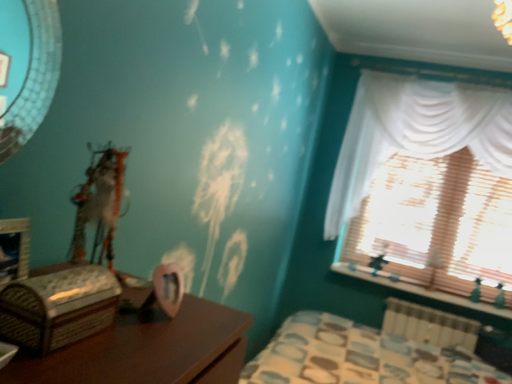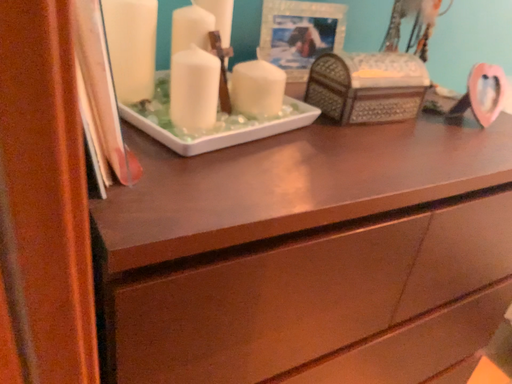
Question: How did the camera likely rotate when shooting the video?

Choices:
 (A) rotated right
 (B) rotated left

Answer: (B)